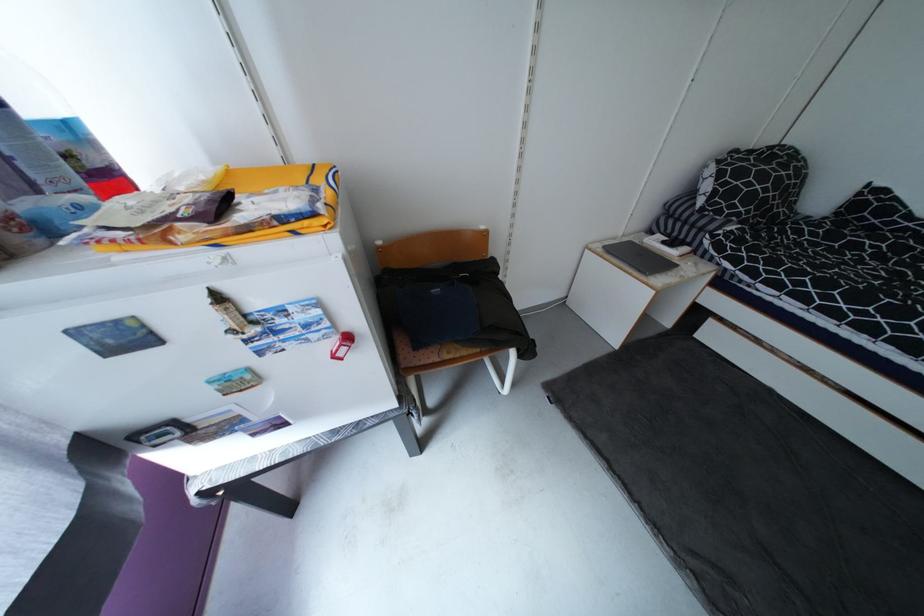
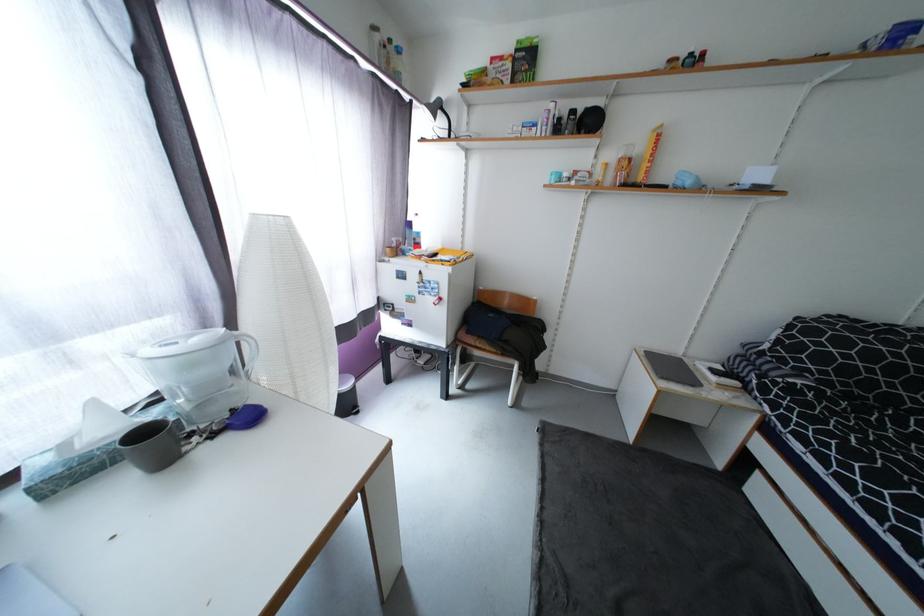
The point at (690, 251) is marked in the first image. Where is the corresponding point in the second image?

(740, 385)